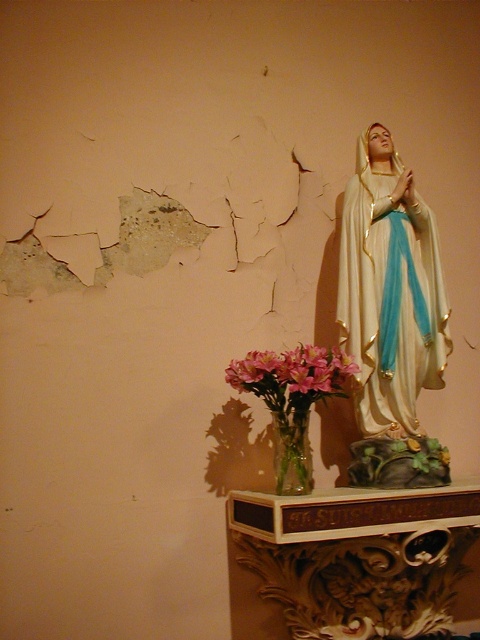
Between white glossy statue at upper right and pink glass vase at lower center, which one has more height?

With more height is white glossy statue at upper right.

Which is more to the right, white glossy statue at upper right or pink glass vase at lower center?

white glossy statue at upper right

Is point (429, 320) in front of point (311, 390)?

No, (429, 320) is further to viewer.

Identify the location of white glossy statue at upper right. (389, 291).

Is pink glass vase at lower center smaller than clear glass vase at lower center?

No.

Which is more to the right, pink glass vase at lower center or clear glass vase at lower center?

Positioned to the right is clear glass vase at lower center.

Image resolution: width=480 pixels, height=640 pixels. I want to click on pink glass vase at lower center, so click(x=291, y=376).

Measure the distance between white glossy statue at upper right and clear glass vase at lower center.

white glossy statue at upper right is 35.86 centimeters away from clear glass vase at lower center.

Which of these two, white glossy statue at upper right or clear glass vase at lower center, stands shorter?

clear glass vase at lower center is shorter.

Who is more distant from viewer, (x=362, y=241) or (x=275, y=444)?

The point (x=362, y=241) is behind.

At what (x,y) coordinates should I click in order to perform the action: click on white glossy statue at upper right. Please return your answer as a coordinate pair (x, y). This screenshot has width=480, height=640. Looking at the image, I should click on (389, 291).